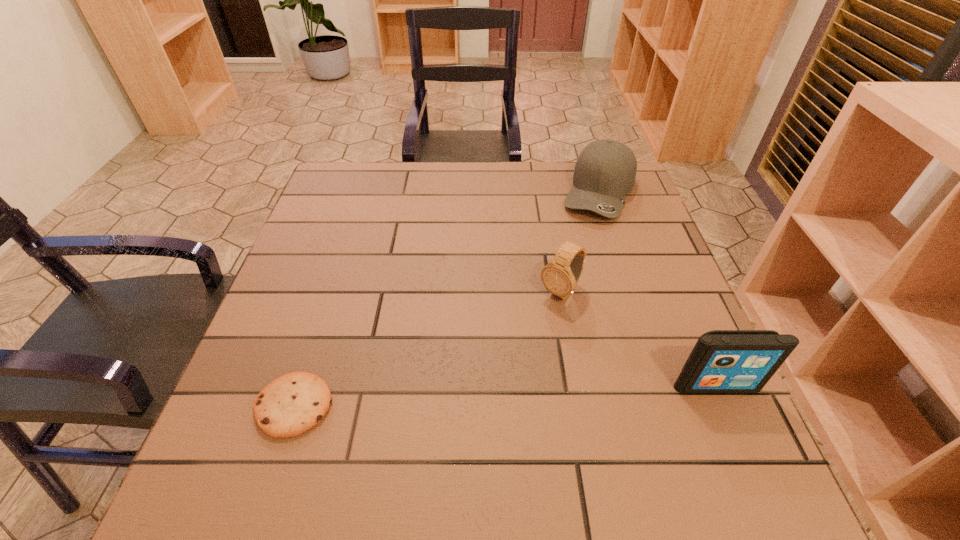
Find the location of a particular element. The image size is (960, 540). vacant space on the desktop that is between the cookie and the iPod and is positioned on the front brim of the baseball cap is located at coordinates (536, 394).

I want to click on vacant space on the desktop that is between the leftmost object and the iPod and is positioned on the face of the watch, so click(465, 397).